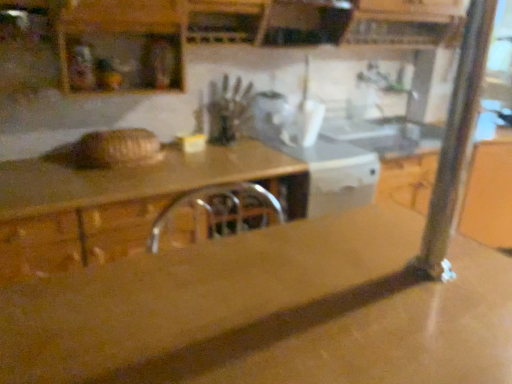
Question: From the image's perspective, is brown polished wood countertop at center on top of white glossy microwave at center?

Choices:
 (A) yes
 (B) no

Answer: (B)

Question: Is brown polished wood countertop at center further to camera compared to white glossy microwave at center?

Choices:
 (A) yes
 (B) no

Answer: (B)

Question: Can you confirm if brown polished wood countertop at center is bigger than white glossy microwave at center?

Choices:
 (A) no
 (B) yes

Answer: (B)

Question: Can you confirm if brown polished wood countertop at center is shorter than white glossy microwave at center?

Choices:
 (A) no
 (B) yes

Answer: (A)

Question: From a real-world perspective, does brown polished wood countertop at center sit lower than white glossy microwave at center?

Choices:
 (A) no
 (B) yes

Answer: (B)

Question: From the image's perspective, is brown polished wood countertop at center below white glossy microwave at center?

Choices:
 (A) no
 (B) yes

Answer: (B)

Question: Is white glossy microwave at center at the left side of brown polished wood countertop at center?

Choices:
 (A) yes
 (B) no

Answer: (B)

Question: Is white glossy microwave at center further to the viewer compared to brown polished wood countertop at center?

Choices:
 (A) no
 (B) yes

Answer: (B)

Question: From a real-world perspective, does white glossy microwave at center stand above brown polished wood countertop at center?

Choices:
 (A) yes
 (B) no

Answer: (A)

Question: From the image's perspective, is white glossy microwave at center beneath brown polished wood countertop at center?

Choices:
 (A) no
 (B) yes

Answer: (A)

Question: Is white glossy microwave at center to the right of brown polished wood countertop at center from the viewer's perspective?

Choices:
 (A) no
 (B) yes

Answer: (B)

Question: Is white glossy microwave at center thinner than brown polished wood countertop at center?

Choices:
 (A) no
 (B) yes

Answer: (B)

Question: Is white glossy microwave at center inside or outside of brown polished wood countertop at center?

Choices:
 (A) inside
 (B) outside

Answer: (B)